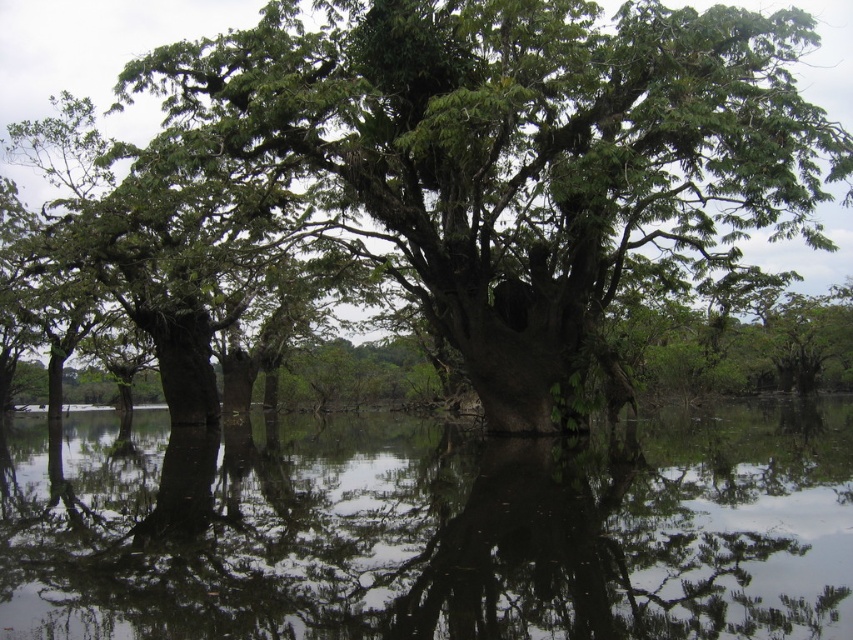
Question: Does clear water at center come in front of green rough bark tree at center?

Choices:
 (A) no
 (B) yes

Answer: (B)

Question: Is clear water at center positioned before green rough bark tree at center?

Choices:
 (A) no
 (B) yes

Answer: (B)

Question: Which point is closer to the camera taking this photo?

Choices:
 (A) (398, 116)
 (B) (502, 534)

Answer: (B)

Question: Does clear water at center have a smaller size compared to green rough bark tree at center?

Choices:
 (A) yes
 (B) no

Answer: (A)